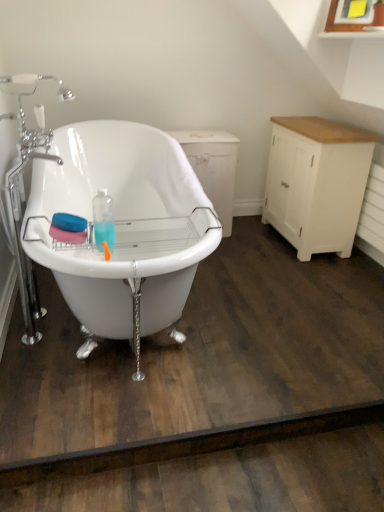
This screenshot has width=384, height=512. Identify the location of unoccupied region to the right of white glossy bathtub at center. (276, 306).